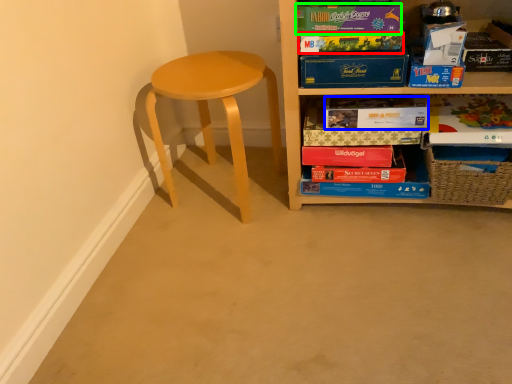
Question: Based on their relative distances, which object is nearer to paperback book (highlighted by a red box)? Choose from paperback book (highlighted by a blue box) and paperback book (highlighted by a green box).

Choices:
 (A) paperback book
 (B) paperback book

Answer: (B)